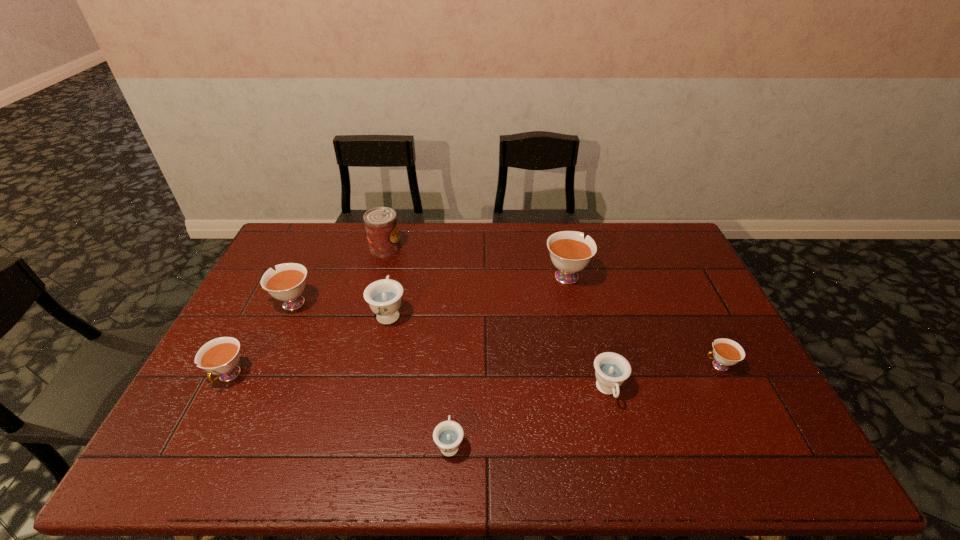
I want to click on can, so click(x=381, y=225).

Identify the location of the second white teacup from right to left. This screenshot has width=960, height=540. (570, 253).

I want to click on the biggest white teacup, so click(x=570, y=253).

Find the location of a particular element. The width and height of the screenshot is (960, 540). the third smallest white teacup is located at coordinates (287, 283).

Identify the location of the biggest blue teacup. The width and height of the screenshot is (960, 540). tap(384, 296).

At what (x,y) coordinates should I click in order to perform the action: click on the farthest blue teacup. Please return your answer as a coordinate pair (x, y). Image resolution: width=960 pixels, height=540 pixels. Looking at the image, I should click on (384, 296).

Where is `the third biggest white teacup`? the third biggest white teacup is located at coordinates pos(220,356).

Where is `the rightmost blue teacup`? The width and height of the screenshot is (960, 540). the rightmost blue teacup is located at coordinates (611, 369).

This screenshot has height=540, width=960. Find the location of `the second farthest blue teacup`. the second farthest blue teacup is located at coordinates (611, 369).

Locate an element on the screen. This screenshot has width=960, height=540. the rightmost object is located at coordinates (726, 352).